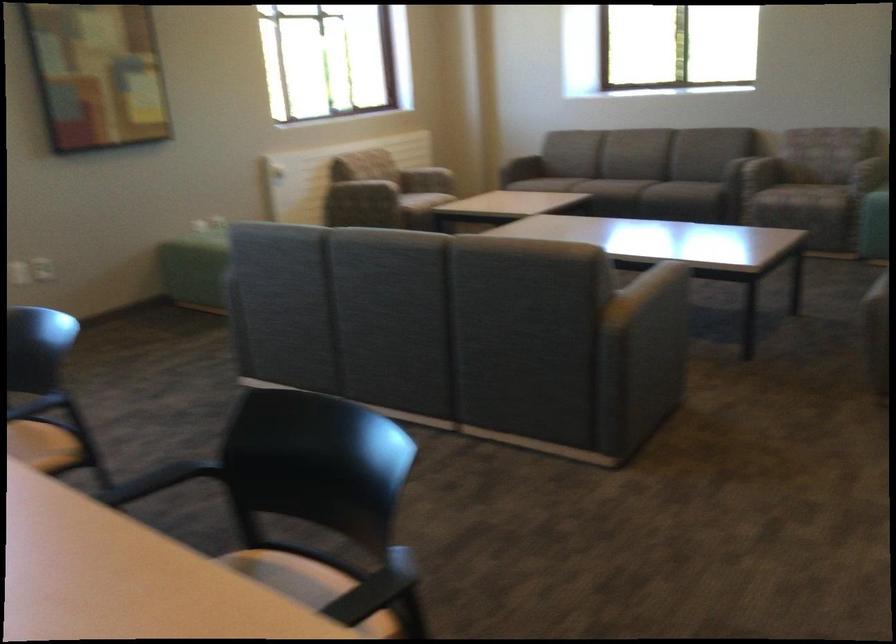
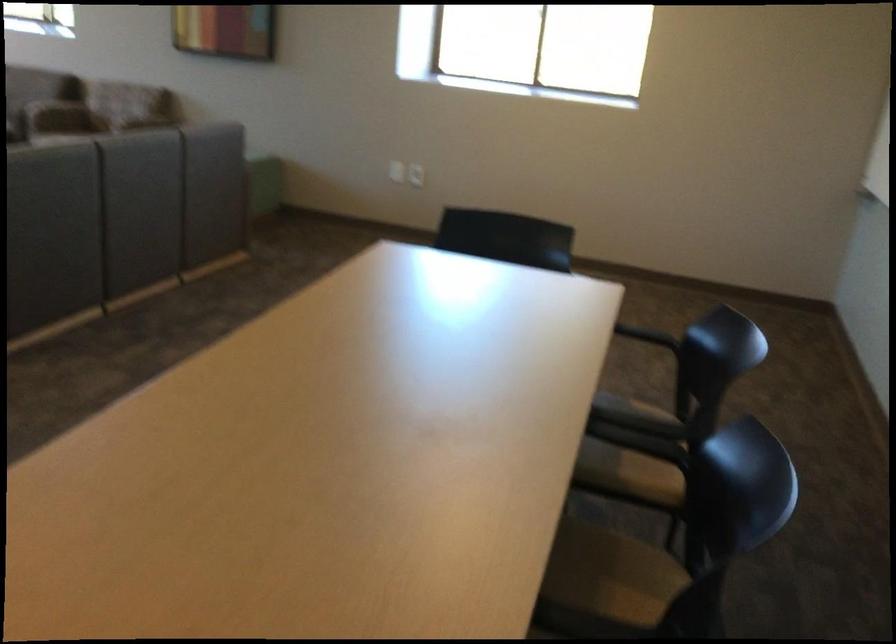
Question: In a continuous first-person perspective shot, in which direction is the camera moving?

Choices:
 (A) Left
 (B) Right
 (C) Forward
 (D) Backward

Answer: (B)